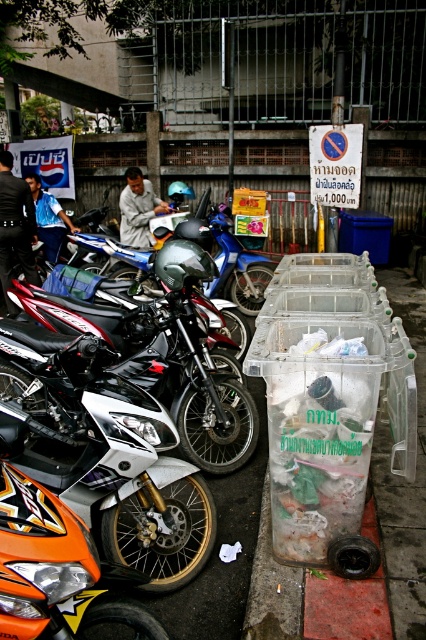
You are a photographer standing in the middle of the street. You see a dark blue shirt at left and a blue shirt at center. Which shirt is closer to the parked motorcycles?

The dark blue shirt at left is closer to the parked motorcycles because it is positioned under the blue shirt at center, meaning it is lower in the image and likely nearer to the motorcycles on the left side.

You are a tailor measuring shirts for a customer. You have two shirts to compare in the image. Which shirt has a smaller width? The dark blue shirt at left and the light brown fabric shirt at center are both visible. Please determine which one is narrower.

The dark blue shirt at left has a lesser width compared to the light brown fabric shirt at center, so the dark blue shirt at left is narrower.

You are a photographer standing in the middle of the urban street scene. You notice a dark blue shirt at left and a blue shirt at center. Which shirt is closer to the parked motorcycles on the left side?

The dark blue shirt at left is closer to the parked motorcycles on the left side because it is positioned on the left side of the blue shirt at center, which is further to the right.